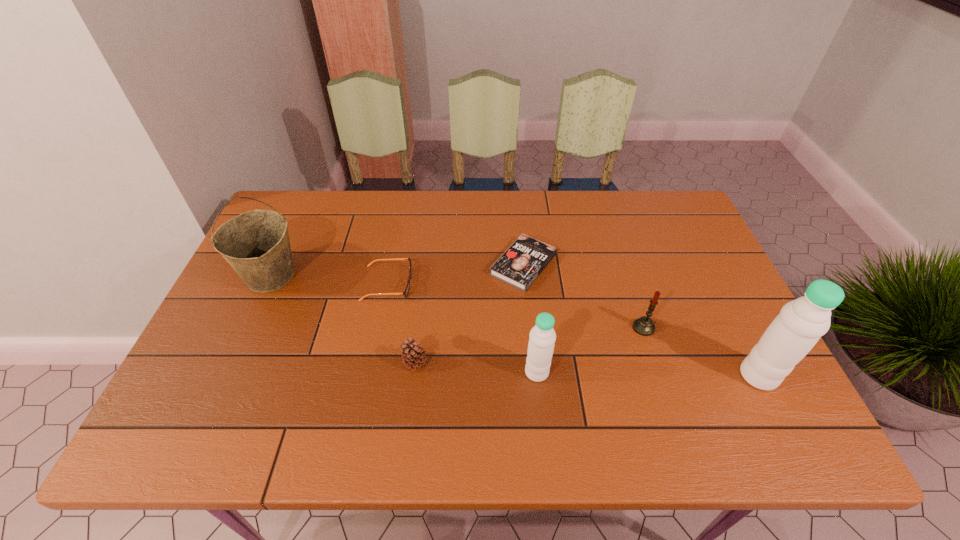
Where is `vacant space in between the right water bottle and the spectacles`? Image resolution: width=960 pixels, height=540 pixels. vacant space in between the right water bottle and the spectacles is located at coordinates coord(573,330).

You are a GUI agent. You are given a task and a screenshot of the screen. Output one action in this format:
    pyautogui.click(x=<x>, y=<y>)
    Task: Click on the free space between the spectacles and the taller water bottle
    This screenshot has width=960, height=540.
    Given the screenshot: What is the action you would take?
    pyautogui.click(x=573, y=330)

Where is `free space between the second object from left to right and the wine bucket`? free space between the second object from left to right and the wine bucket is located at coordinates (329, 280).

Where is `free space between the spectacles and the fourth shortest object`? This screenshot has width=960, height=540. free space between the spectacles and the fourth shortest object is located at coordinates (516, 306).

Where is `empty space between the third tallest object and the candle`? This screenshot has width=960, height=540. empty space between the third tallest object and the candle is located at coordinates (590, 350).

The width and height of the screenshot is (960, 540). In order to click on free space between the left water bottle and the fifth object from right to left in this screenshot , I will do `click(476, 367)`.

Image resolution: width=960 pixels, height=540 pixels. I want to click on object that stands as the fifth closest to the spectacles, so click(x=644, y=326).

Where is `object that can be found as the second closest to the pinecone`? This screenshot has height=540, width=960. object that can be found as the second closest to the pinecone is located at coordinates (542, 337).

This screenshot has width=960, height=540. Find the location of `vacant space that satisfies the following two spatial constraints: 1. on the front side of the candle; 2. on the left side of the wine bucket`. vacant space that satisfies the following two spatial constraints: 1. on the front side of the candle; 2. on the left side of the wine bucket is located at coordinates (248, 328).

You are a GUI agent. You are given a task and a screenshot of the screen. Output one action in this format:
    pyautogui.click(x=<x>, y=<y>)
    Task: Click on the free space that satisfies the following two spatial constraints: 1. on the front side of the rightmost object; 2. on the right side of the candle
    
    Given the screenshot: What is the action you would take?
    pyautogui.click(x=659, y=376)